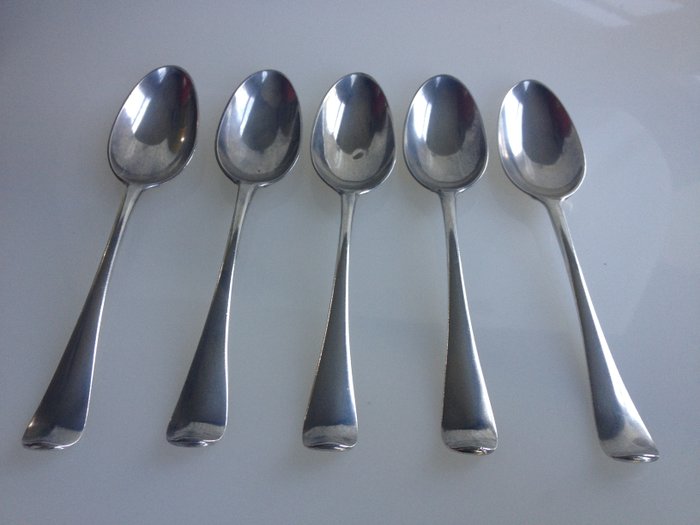
I want to click on spoons, so click(x=152, y=112), click(x=259, y=130), click(x=372, y=133), click(x=437, y=136), click(x=550, y=153).